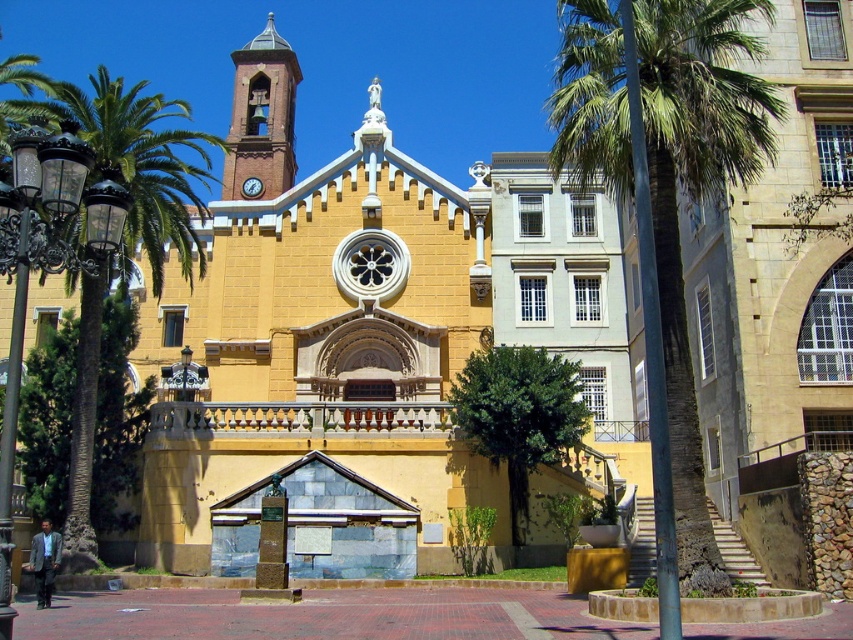
Question: Does green leafy palm tree at right have a larger size compared to brick stonework bell tower at upper center?

Choices:
 (A) no
 (B) yes

Answer: (B)

Question: Which object is closer to the camera taking this photo?

Choices:
 (A) brick stonework bell tower at upper center
 (B) green leafy palm tree at left
 (C) green leafy palm tree at right
 (D) metallic clock at center

Answer: (C)

Question: Which object is the closest to the green leafy palm tree at right?

Choices:
 (A) brick stonework bell tower at upper center
 (B) metallic clock at center
 (C) green leafy palm tree at left

Answer: (C)

Question: Which point appears farthest from the camera in this image?

Choices:
 (A) (250, 188)
 (B) (722, 136)
 (C) (80, 413)

Answer: (A)

Question: Does green leafy palm tree at right have a larger size compared to green leafy palm tree at left?

Choices:
 (A) no
 (B) yes

Answer: (A)

Question: Does green leafy palm tree at right appear on the right side of metallic clock at center?

Choices:
 (A) yes
 (B) no

Answer: (A)